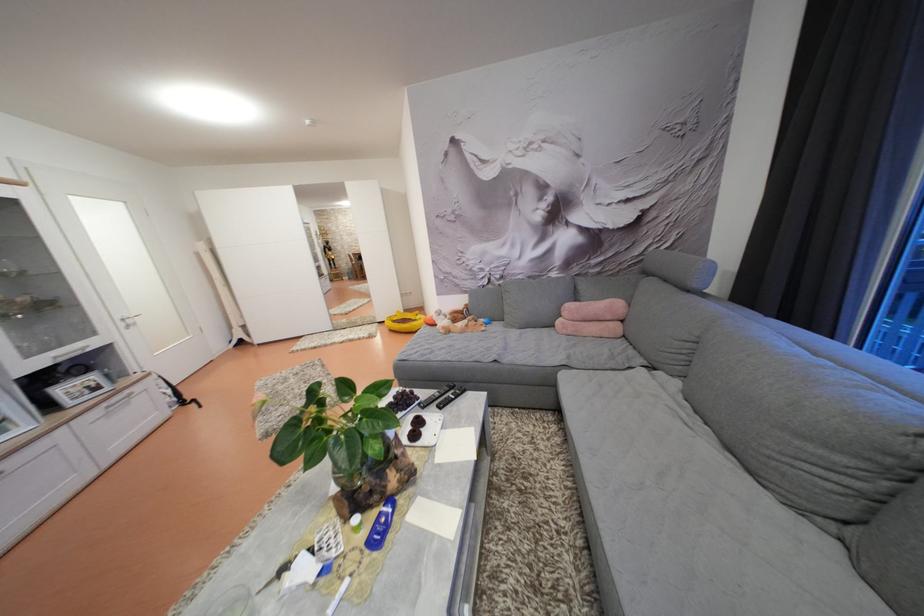
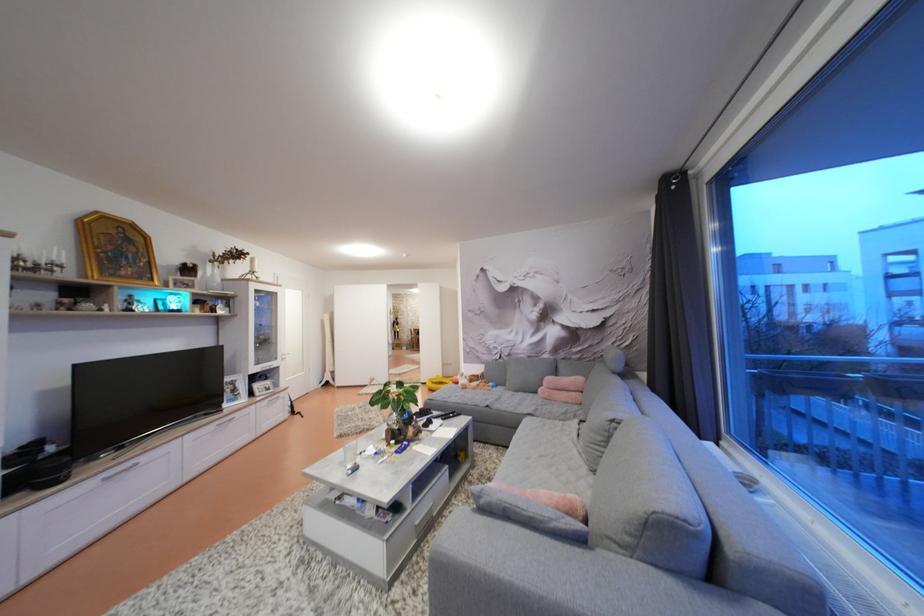
Where in the second image is the point corresponding to point 274,440 from the first image?

(348, 440)